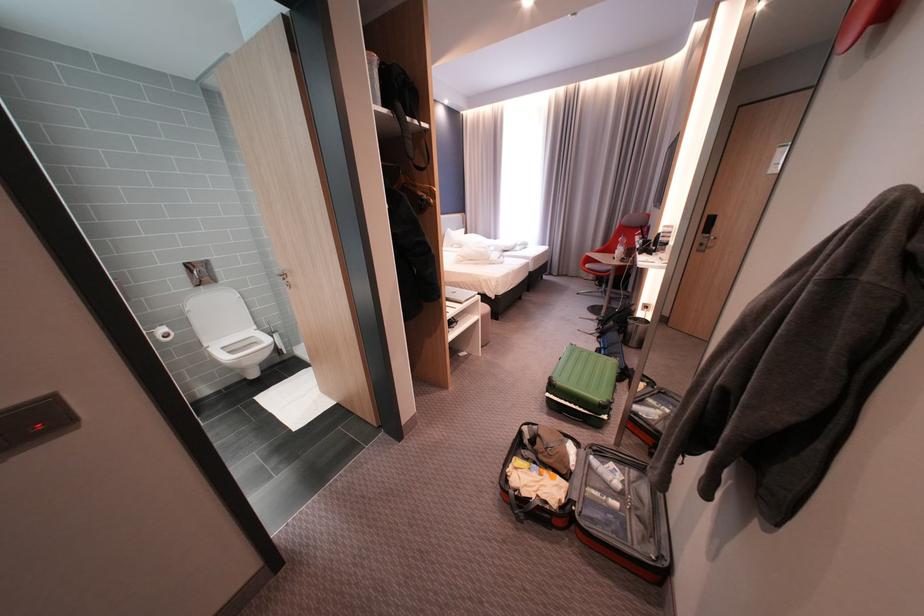
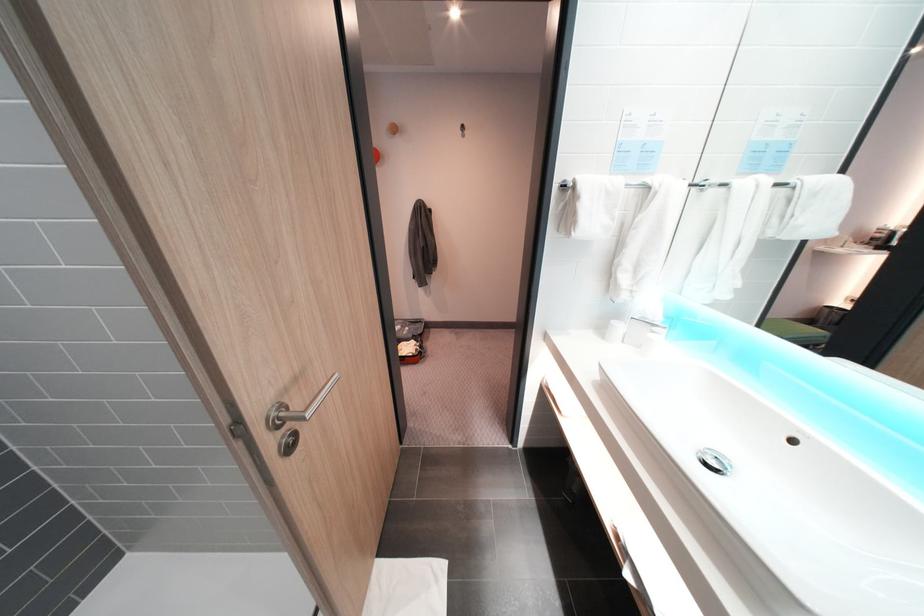
Question: I am providing you with two images of the same scene from different viewpoints. After the viewpoint changes to image2, which objects are now occluded?

Choices:
 (A) small wall hook
 (B) black light switch
 (C) white tumbler
 (D) brown leather sitting surface

Answer: (B)